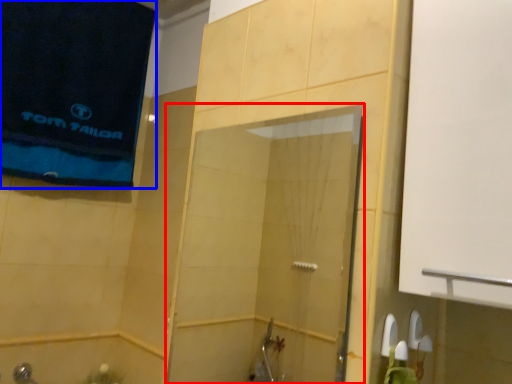
Question: Which object appears farthest to the camera in this image, screen door (highlighted by a red box) or beach towel (highlighted by a blue box)?

Choices:
 (A) screen door
 (B) beach towel

Answer: (B)